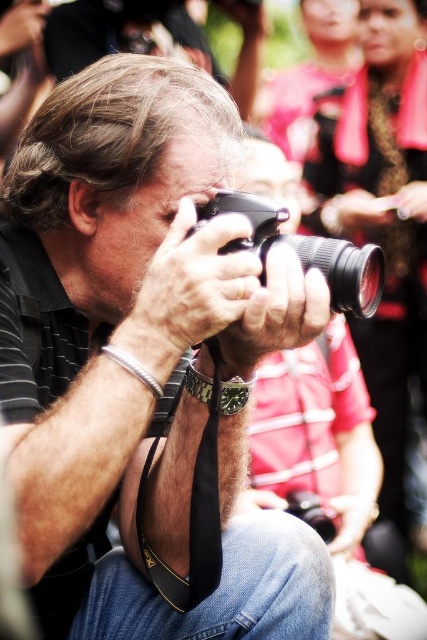
Can you confirm if matte black camera at center is positioned above black plastic camera at center?

Actually, matte black camera at center is below black plastic camera at center.

Between point (3, 369) and point (341, 304), which one is positioned in front?

Point (341, 304) is more forward.

The height and width of the screenshot is (640, 427). In order to click on matte black camera at center in this screenshot , I will do `click(140, 352)`.